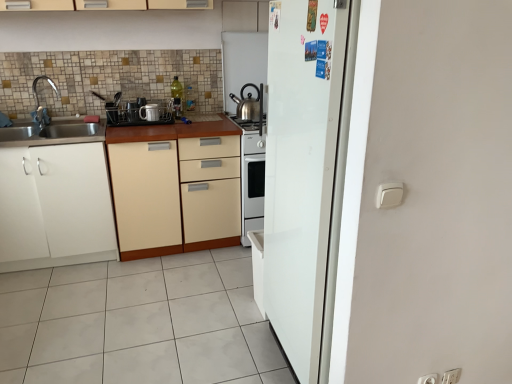
Question: Which direction should I rotate to look at metallic silver pot at center, which is the 2th appliance in left-to-right order, — up or down?

Choices:
 (A) up
 (B) down

Answer: (A)

Question: Does white tile floor at lower center have a greater width compared to metallic dish rack at center, acting as the third appliance starting from the right?

Choices:
 (A) yes
 (B) no

Answer: (A)

Question: Can you confirm if white tile floor at lower center is positioned to the right of metallic dish rack at center, the 1th appliance positioned from the left?

Choices:
 (A) yes
 (B) no

Answer: (A)

Question: Is white tile floor at lower center bigger than metallic dish rack at center, the 1th appliance positioned from the left?

Choices:
 (A) yes
 (B) no

Answer: (A)

Question: Considering the relative sizes of white tile floor at lower center and metallic dish rack at center, acting as the third appliance starting from the right, in the image provided, is white tile floor at lower center taller than metallic dish rack at center, acting as the third appliance starting from the right,?

Choices:
 (A) yes
 (B) no

Answer: (B)

Question: Is white tile floor at lower center located outside metallic dish rack at center, the 1th appliance positioned from the left?

Choices:
 (A) yes
 (B) no

Answer: (A)

Question: From a real-world perspective, is white tile floor at lower center under metallic dish rack at center, the 1th appliance positioned from the left?

Choices:
 (A) yes
 (B) no

Answer: (A)

Question: From a real-world perspective, is stainless steel kettle at center, which ranks as the first appliance in right-to-left order, beneath beige matte cabinet at center, positioned as the first cabinetry in right-to-left order?

Choices:
 (A) yes
 (B) no

Answer: (B)

Question: Considering the relative sizes of stainless steel kettle at center, which ranks as the first appliance in right-to-left order, and beige matte cabinet at center, positioned as the first cabinetry in right-to-left order, in the image provided, is stainless steel kettle at center, which ranks as the first appliance in right-to-left order, bigger than beige matte cabinet at center, positioned as the first cabinetry in right-to-left order,?

Choices:
 (A) no
 (B) yes

Answer: (A)

Question: From the image's perspective, does stainless steel kettle at center, which ranks as the first appliance in right-to-left order, appear lower than beige matte cabinet at center, positioned as the first cabinetry in right-to-left order?

Choices:
 (A) no
 (B) yes

Answer: (A)

Question: Are stainless steel kettle at center, which ranks as the first appliance in right-to-left order, and beige matte cabinet at center, positioned as the first cabinetry in right-to-left order, far apart?

Choices:
 (A) no
 (B) yes

Answer: (A)

Question: Is stainless steel kettle at center, which is the 3th appliance in left-to-right order, surrounding beige matte cabinet at center, positioned as the first cabinetry in right-to-left order?

Choices:
 (A) no
 (B) yes

Answer: (A)

Question: Is stainless steel kettle at center, which is the 3th appliance in left-to-right order, outside beige matte cabinet at center, positioned as the first cabinetry in right-to-left order?

Choices:
 (A) no
 (B) yes

Answer: (B)

Question: From a real-world perspective, is stainless steel kettle at center, which is the 3th appliance in left-to-right order, physically above metallic dish rack at center, acting as the third appliance starting from the right?

Choices:
 (A) yes
 (B) no

Answer: (A)